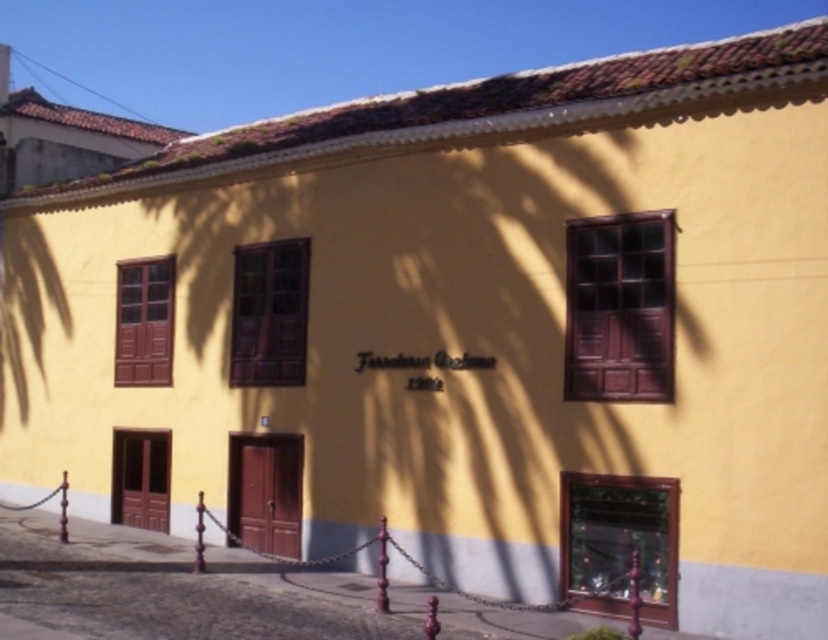
Question: Among these objects, which one is nearest to the camera?

Choices:
 (A) matte brown wooden window at center
 (B) brown wooden window at upper center

Answer: (B)

Question: Which of the following is the closest to the observer?

Choices:
 (A) (145, 269)
 (B) (602, 364)

Answer: (B)

Question: Does brown wooden window at upper center appear under matte wood window at left?

Choices:
 (A) yes
 (B) no

Answer: (B)

Question: Which of the following is the closest to the observer?

Choices:
 (A) (260, 307)
 (B) (118, 346)
 (C) (651, 257)

Answer: (C)

Question: Can you confirm if brown wooden window at upper center is positioned below matte brown wooden window at center?

Choices:
 (A) yes
 (B) no

Answer: (B)

Question: Is brown wooden window at upper center wider than matte wood window at left?

Choices:
 (A) yes
 (B) no

Answer: (B)